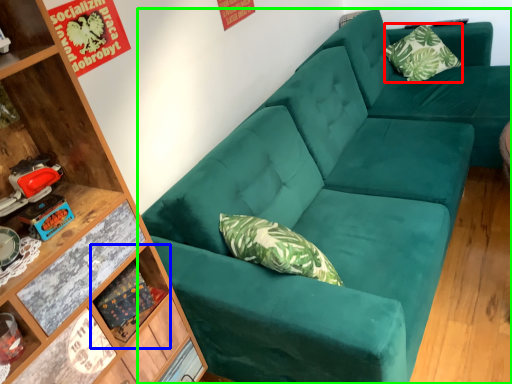
Question: Based on their relative distances, which object is farther from pillow (highlighted by a red box)? Choose from shelf (highlighted by a blue box) and studio couch (highlighted by a green box).

Choices:
 (A) shelf
 (B) studio couch

Answer: (A)